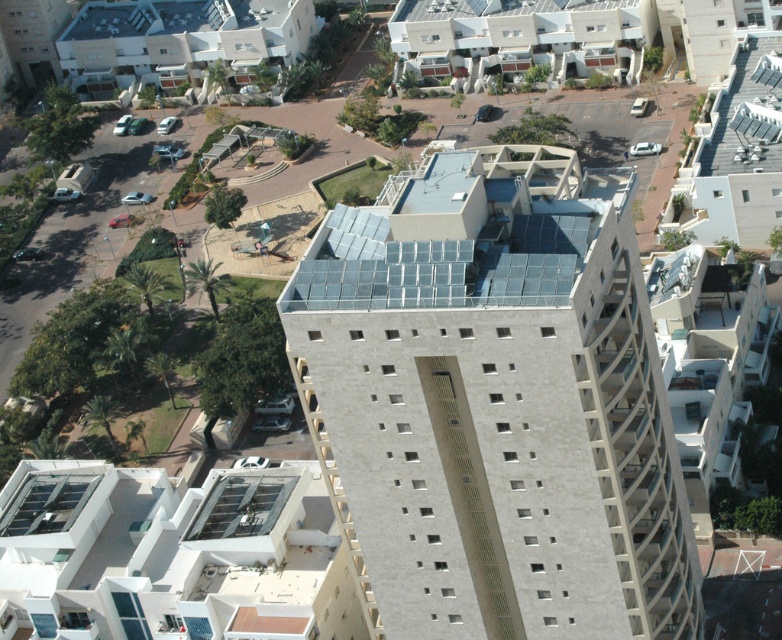
Is smooth concrete building at center wider than beige concrete building at upper center?

No, smooth concrete building at center is not wider than beige concrete building at upper center.

Is smooth concrete building at center bigger than beige concrete building at upper center?

Yes.

Where is `smooth concrete building at center`? Image resolution: width=782 pixels, height=640 pixels. smooth concrete building at center is located at coordinates (493, 406).

The image size is (782, 640). Identify the location of beige concrete building at upper center. tap(152, 38).

Identify the location of beige concrete building at upper center. (152, 38).

You are a GUI agent. You are given a task and a screenshot of the screen. Output one action in this format:
    pyautogui.click(x=<x>, y=<y>)
    Task: Click on the beige concrete building at upper center
    This screenshot has width=782, height=640.
    Given the screenshot: What is the action you would take?
    pyautogui.click(x=152, y=38)

Does smooth concrete building at center appear over white matte building at lower left?

Yes, smooth concrete building at center is above white matte building at lower left.

Is point (569, 502) farther from viewer compared to point (63, 545)?

No, (569, 502) is closer to viewer.

Who is more distant from viewer, (318, 294) or (224, 563)?

Point (224, 563)

Find the location of a particular element. Image resolution: width=782 pixels, height=640 pixels. smooth concrete building at center is located at coordinates (493, 406).